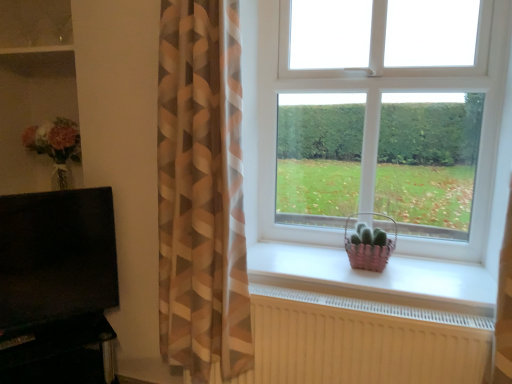
Question: Can you confirm if pink woven basket at window is shorter than brown/white striped curtain at left?

Choices:
 (A) yes
 (B) no

Answer: (A)

Question: From the image's perspective, is pink woven basket at window on brown/white striped curtain at left?

Choices:
 (A) yes
 (B) no

Answer: (B)

Question: From the image's perspective, does pink woven basket at window appear lower than brown/white striped curtain at left?

Choices:
 (A) yes
 (B) no

Answer: (A)

Question: Is pink woven basket at window not near brown/white striped curtain at left?

Choices:
 (A) yes
 (B) no

Answer: (B)

Question: From a real-world perspective, is pink woven basket at window over brown/white striped curtain at left?

Choices:
 (A) no
 (B) yes

Answer: (A)

Question: Would you say black matte tv at left, which is the 1th entertainment center from top to bottom, is inside or outside black glossy entertainment center at lower left, which ranks as the 1th entertainment center in bottom-to-top order?

Choices:
 (A) outside
 (B) inside

Answer: (A)

Question: Visually, is black matte tv at left, which is the 1th entertainment center from top to bottom, positioned to the left or to the right of black glossy entertainment center at lower left, which ranks as the 1th entertainment center in bottom-to-top order?

Choices:
 (A) right
 (B) left

Answer: (B)

Question: From the image's perspective, is black matte tv at left, which is the 1th entertainment center from top to bottom, positioned above or below black glossy entertainment center at lower left, which ranks as the 1th entertainment center in bottom-to-top order?

Choices:
 (A) above
 (B) below

Answer: (A)

Question: From a real-world perspective, is black matte tv at left, which is the 1th entertainment center from top to bottom, positioned above or below black glossy entertainment center at lower left, arranged as the second entertainment center when viewed from the top?

Choices:
 (A) below
 (B) above

Answer: (B)

Question: From the image's perspective, is white plastic window at center positioned above or below white matte window sill at center?

Choices:
 (A) above
 (B) below

Answer: (A)

Question: Based on their sizes in the image, would you say white plastic window at center is bigger or smaller than white matte window sill at center?

Choices:
 (A) big
 (B) small

Answer: (A)

Question: Do you think white plastic window at center is within white matte window sill at center, or outside of it?

Choices:
 (A) outside
 (B) inside

Answer: (A)

Question: From a real-world perspective, is white plastic window at center above or below white matte window sill at center?

Choices:
 (A) below
 (B) above

Answer: (B)

Question: In the image, is white matte window sill at center positioned in front of or behind brown/white striped curtain at left?

Choices:
 (A) front
 (B) behind

Answer: (B)

Question: Is point (441, 263) closer or farther from the camera than point (201, 326)?

Choices:
 (A) closer
 (B) farther

Answer: (B)